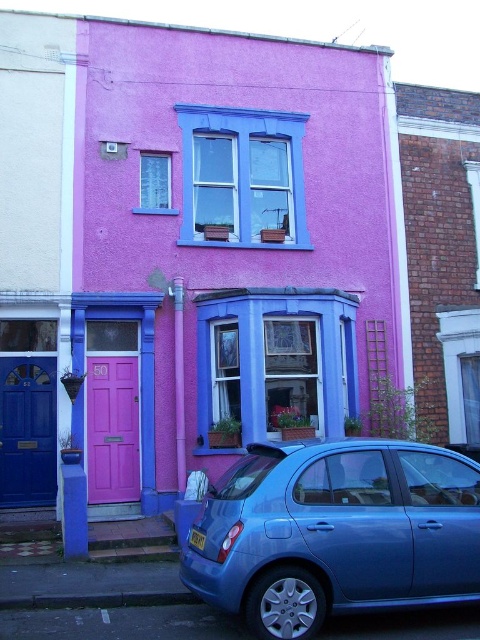
Is the position of matte blue door at left less distant than that of pink matte door at center?

That is True.

Between matte blue door at left and pink matte door at center, which one is positioned lower?

matte blue door at left is lower down.

The image size is (480, 640). In order to click on matte blue door at left in this screenshot , I will do `click(27, 432)`.

At what (x,y) coordinates should I click in order to perform the action: click on matte blue door at left. Please return your answer as a coordinate pair (x, y). The width and height of the screenshot is (480, 640). Looking at the image, I should click on (27, 432).

Which of these two, metallic blue hatchback at lower center or matte blue door at left, stands shorter?

Standing shorter between the two is metallic blue hatchback at lower center.

Can you confirm if metallic blue hatchback at lower center is smaller than matte blue door at left?

No.

In the scene shown: Who is more forward, (200, 548) or (3, 486)?

Point (200, 548)

Where is `metallic blue hatchback at lower center`? This screenshot has width=480, height=640. metallic blue hatchback at lower center is located at coordinates (336, 532).

Who is lower down, metallic blue hatchback at lower center or pink matte door at center?

metallic blue hatchback at lower center is below.

Which is in front, point (419, 592) or point (101, 432)?

Point (419, 592) is in front.

This screenshot has height=640, width=480. I want to click on metallic blue hatchback at lower center, so click(336, 532).